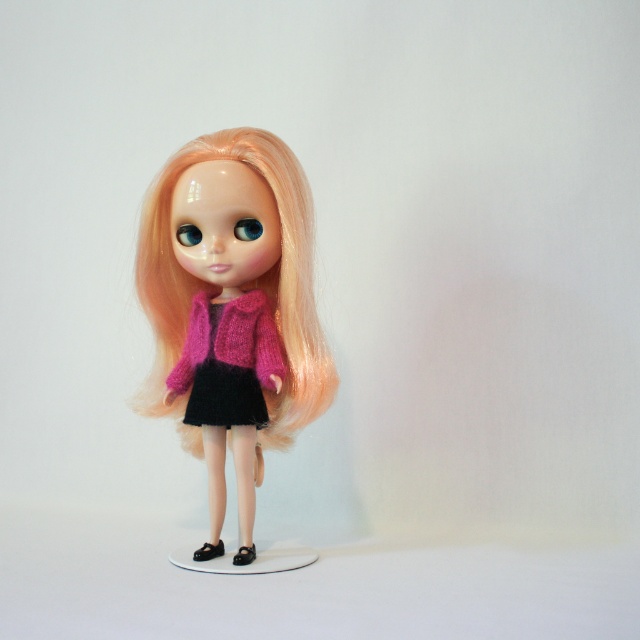
Question: Which point is closer to the camera?

Choices:
 (A) pink knitted sweater at center
 (B) fuzzy pink sweater at center

Answer: (A)

Question: Can you confirm if pink knitted sweater at center is smaller than fuzzy pink sweater at center?

Choices:
 (A) yes
 (B) no

Answer: (B)

Question: Is pink knitted sweater at center wider than fuzzy pink sweater at center?

Choices:
 (A) yes
 (B) no

Answer: (A)

Question: Which point is closer to the camera?

Choices:
 (A) (264, 292)
 (B) (248, 500)

Answer: (B)

Question: Can you confirm if pink knitted sweater at center is thinner than fuzzy pink sweater at center?

Choices:
 (A) yes
 (B) no

Answer: (B)